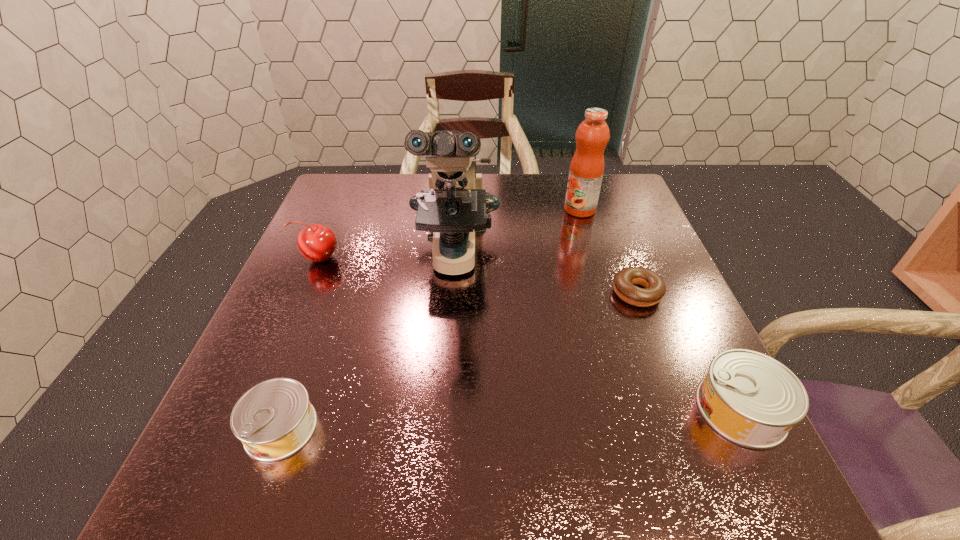
You are a GUI agent. You are given a task and a screenshot of the screen. Output one action in this format:
    pyautogui.click(x=<x>, y=<y>)
    Task: Click on the cherry at the left edge
    
    Given the screenshot: What is the action you would take?
    pyautogui.click(x=317, y=243)

This screenshot has width=960, height=540. What are the coordinates of `can that is at the right edge` in the screenshot? It's located at (751, 399).

Find the location of a particular element. fruit juice situated at the right edge is located at coordinates (586, 171).

Locate an element on the screen. The width and height of the screenshot is (960, 540). doughnut at the right edge is located at coordinates (654, 289).

Where is `object that is at the near left corner`? object that is at the near left corner is located at coordinates (274, 419).

This screenshot has width=960, height=540. Find the location of `object situated at the far right corner`. object situated at the far right corner is located at coordinates (586, 171).

Locate an element on the screen. The width and height of the screenshot is (960, 540). object that is at the near right corner is located at coordinates (751, 399).

Identify the location of vacant area at the far edge of the desktop. This screenshot has height=540, width=960. (491, 180).

Identify the location of vacant space at the near edge of the desktop. This screenshot has height=540, width=960. (606, 398).

Find the location of a particular element. blank space at the left edge is located at coordinates (273, 310).